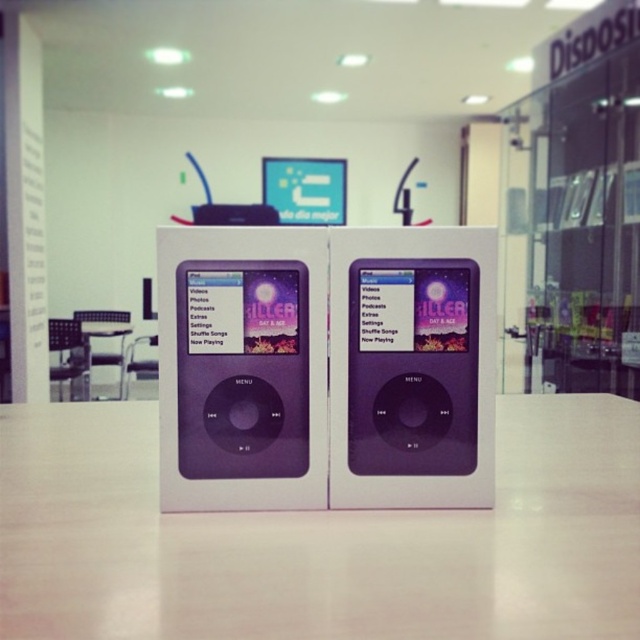
Find the location of a particular element. white matte table at center is located at coordinates (320, 540).

Which is behind, point (609, 435) or point (260, 298)?

The point (609, 435) is behind.

Describe the element at coordinates (320, 540) in the screenshot. The height and width of the screenshot is (640, 640). I see `white matte table at center` at that location.

Locate an element on the screen. white matte table at center is located at coordinates coord(320,540).

Is purple matte/ipod at center behind white glossy table at lower center?

No, purple matte/ipod at center is closer to the viewer.

Between purple matte/ipod at center and white glossy table at lower center, which one appears on the left side from the viewer's perspective?

white glossy table at lower center

This screenshot has width=640, height=640. What do you see at coordinates (241, 369) in the screenshot?
I see `purple matte/ipod at center` at bounding box center [241, 369].

Where is `purple matte/ipod at center`? The height and width of the screenshot is (640, 640). purple matte/ipod at center is located at coordinates (241, 369).

Between point (406, 460) and point (124, 332), which one is positioned in front?

Point (406, 460) is more forward.

Can you confirm if purple glossy ipod at center is positioned to the left of white glossy table at lower center?

In fact, purple glossy ipod at center is to the right of white glossy table at lower center.

This screenshot has height=640, width=640. Describe the element at coordinates (412, 368) in the screenshot. I see `purple glossy ipod at center` at that location.

At what (x,y) coordinates should I click in order to perform the action: click on purple glossy ipod at center. Please return your answer as a coordinate pair (x, y). This screenshot has width=640, height=640. Looking at the image, I should click on (412, 368).